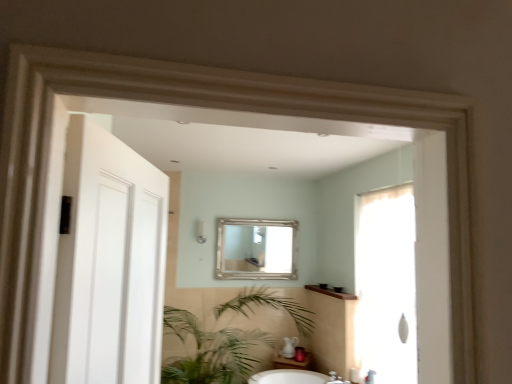
Question: From a real-world perspective, is translucent fabric screen door at right physically located above or below silver metallic mirror at center?

Choices:
 (A) above
 (B) below

Answer: (B)

Question: From the image's perspective, is translucent fabric screen door at right above or below silver metallic mirror at center?

Choices:
 (A) below
 (B) above

Answer: (A)

Question: Which is farther from the silver metallic mirror at center?

Choices:
 (A) green leafy plant at lower center
 (B) white matte door at left
 (C) translucent fabric screen door at right

Answer: (B)

Question: Which object is the closest to the translucent fabric screen door at right?

Choices:
 (A) white matte door at left
 (B) green leafy plant at lower center
 (C) silver metallic mirror at center

Answer: (B)